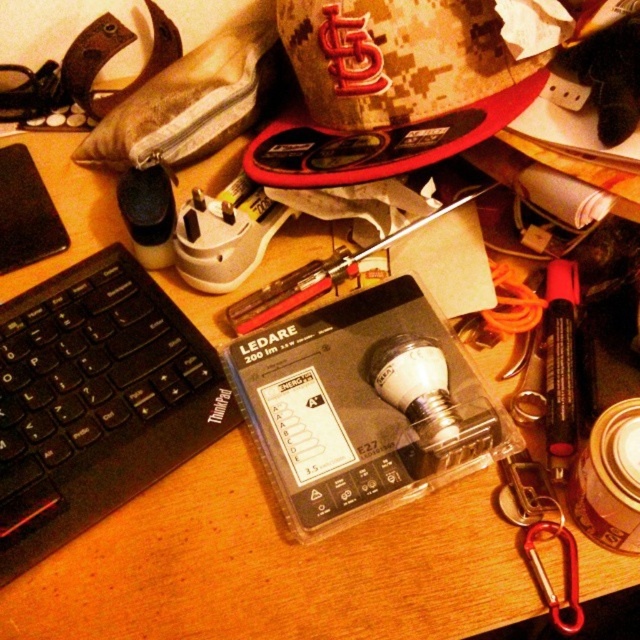
Question: Which of the following is the closest to the observer?

Choices:
 (A) black plastic keyboard at left
 (B) metallic screwdriver at center

Answer: (A)

Question: Does black plastic keyboard at left have a greater width compared to metallic screwdriver at center?

Choices:
 (A) yes
 (B) no

Answer: (B)

Question: Can you confirm if black plastic keyboard at left is bigger than metallic screwdriver at center?

Choices:
 (A) yes
 (B) no

Answer: (A)

Question: In this image, where is black plastic keyboard at left located relative to metallic screwdriver at center?

Choices:
 (A) above
 (B) below

Answer: (B)

Question: Which of the following is the farthest from the observer?

Choices:
 (A) (35, 330)
 (B) (323, 285)

Answer: (B)